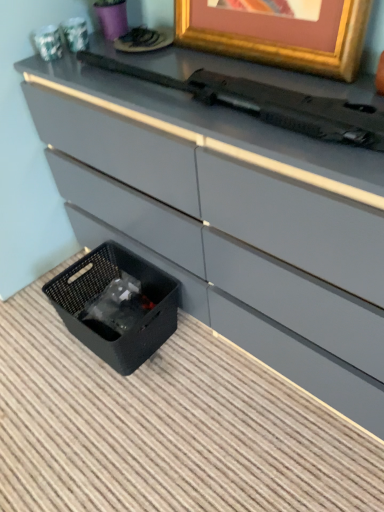
Locate an element on the screen. free space to the left of black woven basket at lower left is located at coordinates (36, 342).